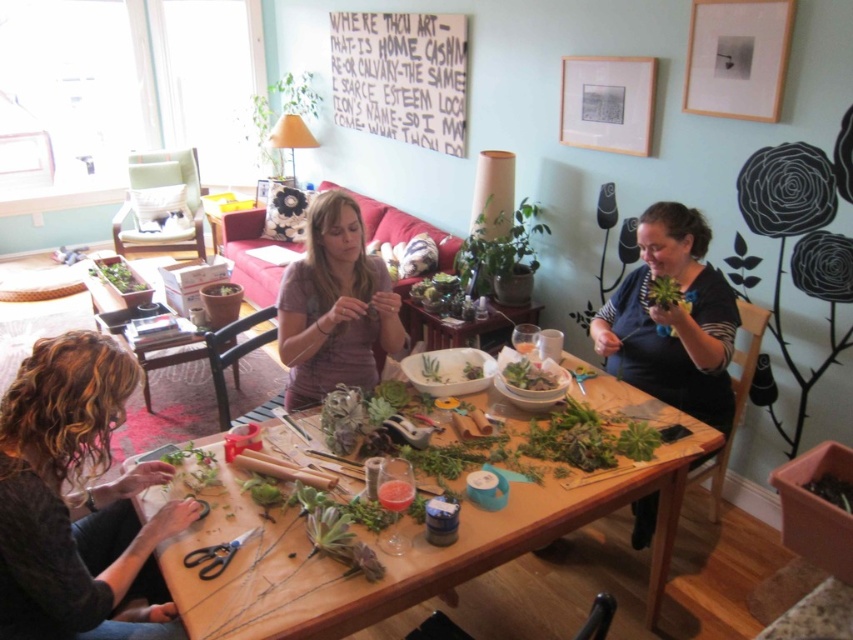
You are taking a photo of the crafting table and want to ensure both the point at point (195, 560) and the point at point (148, 285) are in focus. Which point should you focus on to ensure both are sharp?

You should focus on point (195, 560) because it is closer to the camera, and focusing on the closer object will ensure the farther one is also in focus.

You are a delivery person who needs to place a package on the table between the matte pink shirt at center and the green succulent at center. The package is 3 feet long. Can you fit it between them?

The distance between the matte pink shirt at center and the green succulent at center is 5.88 feet. Since the package is 3 feet long, it can fit between them as there is enough space.

You are a person who needs to cut a piece of string to attach to the green succulent at center. The black plastic scissors at lower left are 8.82 feet away. Can you reach the scissors from where you are standing without moving your feet?

The distance between the black plastic scissors at lower left and the green succulent at center is 8.82 feet. Since the scissors are that far away, you would not be able to reach them without moving your feet.